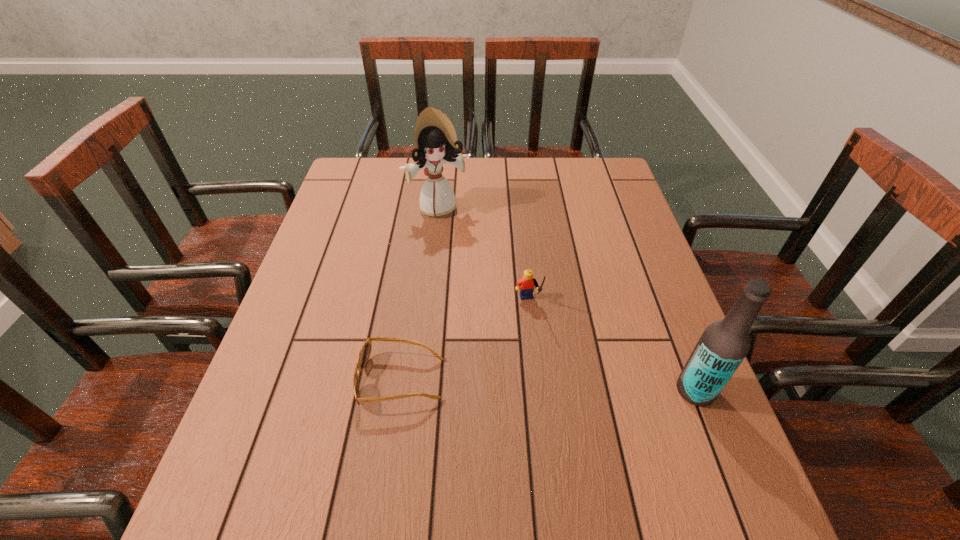
Locate an element on the screen. The height and width of the screenshot is (540, 960). free region at the near edge of the desktop is located at coordinates (632, 433).

Identify the location of vacant space at the left edge. (298, 381).

Locate an element on the screen. The width and height of the screenshot is (960, 540). free space at the right edge of the desktop is located at coordinates (621, 216).

In the image, there is a desktop. Where is `vacant space at the far left corner`? This screenshot has height=540, width=960. vacant space at the far left corner is located at coordinates (384, 197).

Identify the location of vacant space at the far right corner of the desktop. The image size is (960, 540). (602, 195).

In order to click on vacant area that lies between the beer bottle and the sunglasses in this screenshot , I will do `click(548, 385)`.

The image size is (960, 540). I want to click on free spot between the Lego and the farthest object, so click(483, 255).

What are the coordinates of `vacant region between the farthest object and the second object from right to left` in the screenshot? It's located at (483, 255).

Locate an element on the screen. The width and height of the screenshot is (960, 540). empty space that is in between the doll and the Lego is located at coordinates (483, 255).

Where is `unoccupied area between the doll and the sunglasses`? The image size is (960, 540). unoccupied area between the doll and the sunglasses is located at coordinates (420, 294).